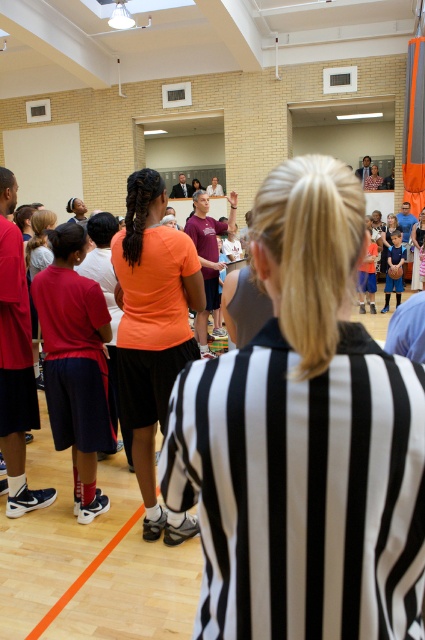
You are standing in the gymnasium and want to throw a ball to a friend. You have two points to choose from as targets. The first is point (255,586) and the second is point (54,260). Which point is closer to you?

Point (255,586) is closer to the camera than point (54,260). Since you are standing in the gymnasium, the point closer to the camera would also be closer to you, so you should choose point (255,586) as your target.